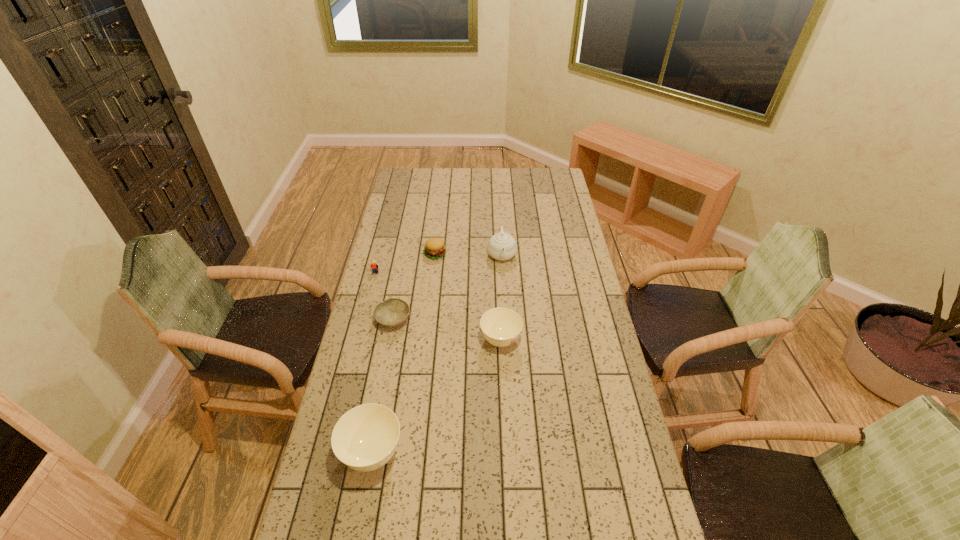
The image size is (960, 540). In order to click on the taller sugar bowl in this screenshot , I will do `click(365, 438)`.

Locate an element on the screen. This screenshot has width=960, height=540. the nearer sugar bowl is located at coordinates (365, 438).

You are a GUI agent. You are given a task and a screenshot of the screen. Output one action in this format:
    pyautogui.click(x=<x>, y=<y>)
    Task: Click on the right sugar bowl
    Image resolution: width=960 pixels, height=540 pixels.
    Given the screenshot: What is the action you would take?
    pyautogui.click(x=501, y=327)

The height and width of the screenshot is (540, 960). I want to click on the farther sugar bowl, so click(501, 327).

Locate an element on the screen. hamburger is located at coordinates click(434, 248).

Identify the location of bowl. The image size is (960, 540). (392, 312).

The height and width of the screenshot is (540, 960). Identify the location of the third farthest object. (373, 266).

The height and width of the screenshot is (540, 960). In order to click on Lego in this screenshot , I will do `click(373, 266)`.

Locate an element on the screen. chinaware is located at coordinates (501, 246).

The height and width of the screenshot is (540, 960). I want to click on free spot located 0.070m on the front of the nearest object, so click(362, 512).